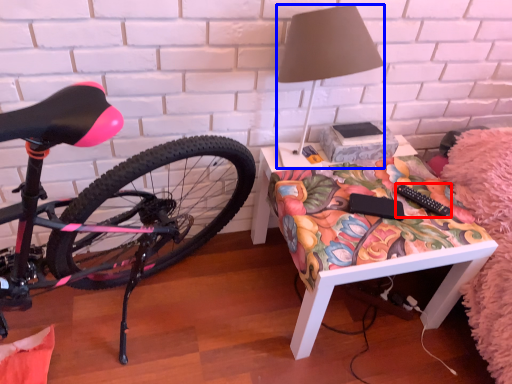
Question: Among these objects, which one is farthest to the camera, remote control (highlighted by a red box) or lamp (highlighted by a blue box)?

Choices:
 (A) remote control
 (B) lamp

Answer: (A)